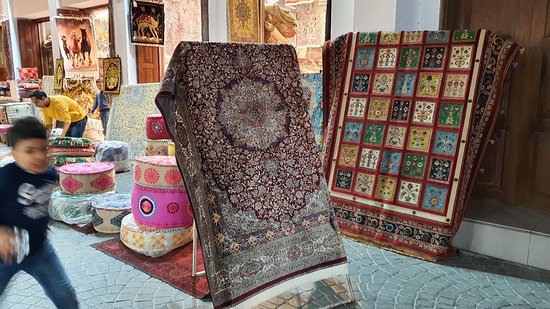
The image size is (550, 309). Identify the location of pillow. (20, 109).